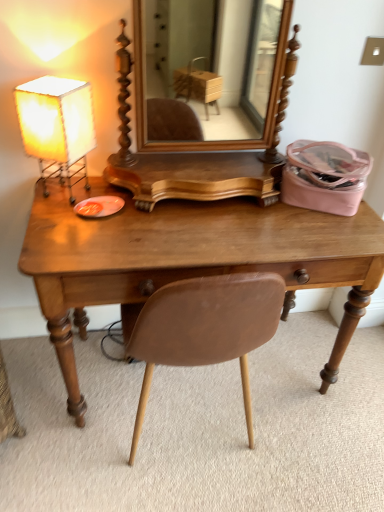
This screenshot has height=512, width=384. What do you see at coordinates (57, 127) in the screenshot?
I see `matte white lampshade at left` at bounding box center [57, 127].

Measure the distance between matte white lampshade at left and camera.

matte white lampshade at left and camera are 1.11 meters apart.

In the scene shown: What is the approximate height of matte white lampshade at left?

The height of matte white lampshade at left is 13.36 inches.

Image resolution: width=384 pixels, height=512 pixels. Find the location of `matte white lampshade at left`. matte white lampshade at left is located at coordinates (57, 127).

Locate an element on the screen. This screenshot has height=512, width=384. wooden desk at center is located at coordinates (188, 260).

In the scene shown: What is the approximate width of wooden desk at center?

It is 20.23 inches.

The image size is (384, 512). What do you see at coordinates (188, 260) in the screenshot? I see `wooden desk at center` at bounding box center [188, 260].

This screenshot has height=512, width=384. I want to click on matte white lampshade at left, so click(57, 127).

Based on their positions, is wooden desk at center located to the left or right of matte white lampshade at left?

Based on their positions, wooden desk at center is located to the right of matte white lampshade at left.

Between wooden desk at center and matte white lampshade at left, which one is positioned in front?

wooden desk at center is in front.

Considering the positions of points (332, 226) and (61, 169), is point (332, 226) farther from camera compared to point (61, 169)?

That is False.

From the image's perspective, is wooden desk at center located beneath matte white lampshade at left?

Yes.

From a real-world perspective, is wooden desk at center located beneath matte white lampshade at left?

Yes, from a real-world perspective, wooden desk at center is below matte white lampshade at left.

Does wooden desk at center have a greater width compared to matte white lampshade at left?

Yes.

Is wooden desk at center taller than matte white lampshade at left?

Yes, wooden desk at center is taller than matte white lampshade at left.

Based on their sizes in the image, would you say wooden desk at center is bigger or smaller than matte white lampshade at left?

Considering their sizes, wooden desk at center takes up more space than matte white lampshade at left.

Would you say wooden desk at center contains matte white lampshade at left?

No, matte white lampshade at left is not surrounded by wooden desk at center.

Is wooden desk at center next to matte white lampshade at left and touching it?

No.

Is wooden desk at center aimed at matte white lampshade at left?

No, wooden desk at center does not turn towards matte white lampshade at left.

What's the angular difference between wooden desk at center and matte white lampshade at left's facing directions?

There is a 59.7-degree angle between the facing directions of wooden desk at center and matte white lampshade at left.

Measure the distance from wooden desk at center to matte white lampshade at left.

A distance of 35.52 centimeters exists between wooden desk at center and matte white lampshade at left.

Where is `desk directly beneath the matte white lampshade at left (from a real-world perspective)`? desk directly beneath the matte white lampshade at left (from a real-world perspective) is located at coordinates (188, 260).

Which is more to the right, matte white lampshade at left or wooden desk at center?

wooden desk at center.

Is the depth of matte white lampshade at left less than that of wooden desk at center?

That is False.

Does point (60, 87) appear closer or farther from the camera than point (95, 267)?

Point (60, 87) is farther from the camera than point (95, 267).

From the image's perspective, is matte white lampshade at left positioned above or below wooden desk at center?

From the image's perspective, matte white lampshade at left appears above wooden desk at center.

From a real-world perspective, which object stands above the other?

In real-world perspective, matte white lampshade at left is above.

Which of these two, matte white lampshade at left or wooden desk at center, is wider?

wooden desk at center is wider.

Which of these two, matte white lampshade at left or wooden desk at center, stands shorter?

matte white lampshade at left is shorter.

Considering the relative sizes of matte white lampshade at left and wooden desk at center in the image provided, is matte white lampshade at left smaller than wooden desk at center?

Indeed, matte white lampshade at left has a smaller size compared to wooden desk at center.

Is wooden desk at center inside matte white lampshade at left?

No, wooden desk at center is located outside of matte white lampshade at left.

Is matte white lampshade at left with wooden desk at center?

There is a gap between matte white lampshade at left and wooden desk at center.

Is matte white lampshade at left positioned with its back to wooden desk at center?

No, matte white lampshade at left is not facing the opposite direction of wooden desk at center.

How many degrees apart are the facing directions of matte white lampshade at left and wooden desk at center?

matte white lampshade at left and wooden desk at center are facing 59.7 degrees away from each other.

Find the location of a particular element. This screenshot has width=384, height=512. desk lying on the right of matte white lampshade at left is located at coordinates (188, 260).

This screenshot has width=384, height=512. What are the coordinates of `desk below the matte white lampshade at left (from the image's perspective)` in the screenshot? It's located at (188, 260).

Find the location of a particular element. The width and height of the screenshot is (384, 512). lamp that appears behind the wooden desk at center is located at coordinates (57, 127).